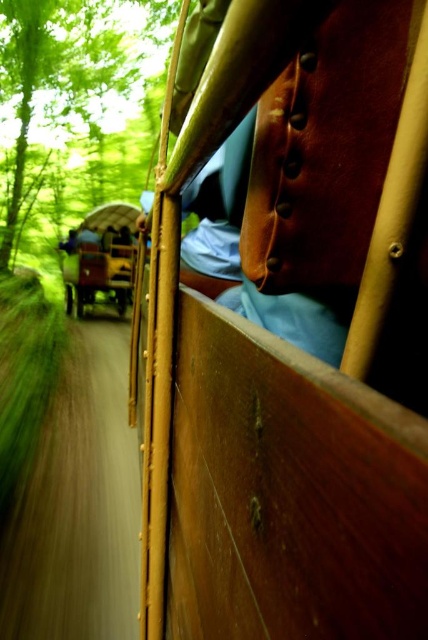
Between point (121, 86) and point (109, 262), which one is positioned behind?

Point (121, 86)

Between green leafy tree at upper left and wooden wagon at center, which one appears on the right side from the viewer's perspective?

Positioned to the right is wooden wagon at center.

The height and width of the screenshot is (640, 428). Find the location of `green leafy tree at upper left`. green leafy tree at upper left is located at coordinates (62, 76).